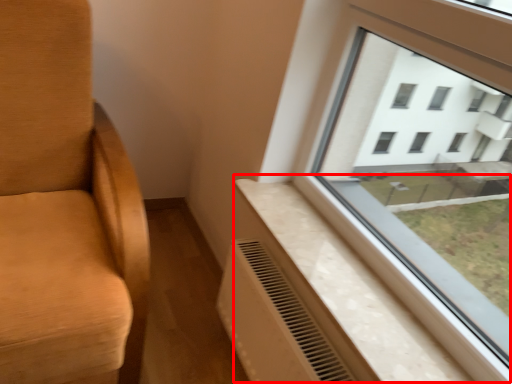
Question: Observing the image, what is the correct spatial positioning of window sill (annotated by the red box) in reference to air conditioning?

Choices:
 (A) left
 (B) right

Answer: (B)